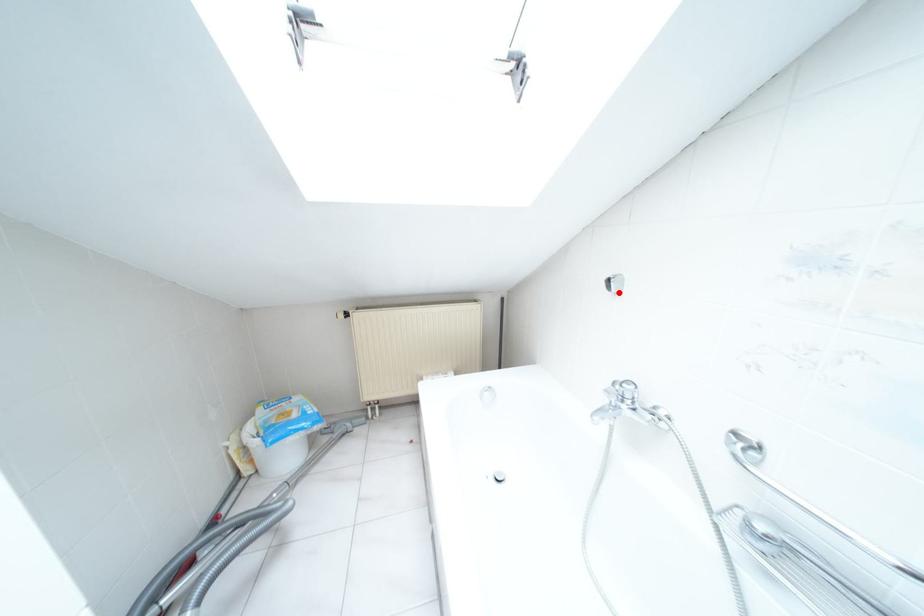
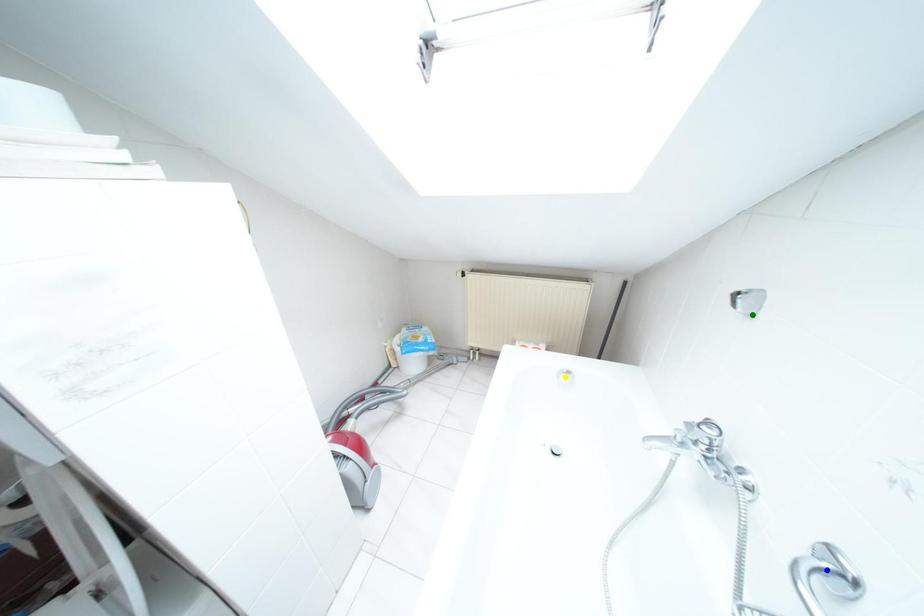
Question: I am providing you with two images of the same scene from different viewpoints. A red point is marked on the first image. You are given multiple points on the second image. Which spot in image 2 lines up with the point in image 1?

Choices:
 (A) green point
 (B) blue point
 (C) yellow point

Answer: (A)